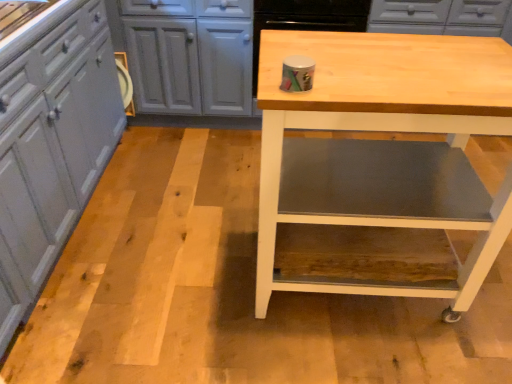
Question: Based on their positions, is matte gray cabinets at left located to the left or right of natural wood table at center?

Choices:
 (A) left
 (B) right

Answer: (A)

Question: In terms of width, does matte gray cabinets at left look wider or thinner when compared to natural wood table at center?

Choices:
 (A) thin
 (B) wide

Answer: (B)

Question: Considering the positions of matte gray cabinets at left and natural wood table at center in the image, is matte gray cabinets at left bigger or smaller than natural wood table at center?

Choices:
 (A) small
 (B) big

Answer: (B)

Question: From a real-world perspective, relative to matte gray cabinets at left, is natural wood table at center vertically above or below?

Choices:
 (A) below
 (B) above

Answer: (B)

Question: In terms of height, does natural wood table at center look taller or shorter compared to matte gray cabinets at left?

Choices:
 (A) short
 (B) tall

Answer: (A)

Question: Considering the positions of natural wood table at center and matte gray cabinets at left in the image, is natural wood table at center wider or thinner than matte gray cabinets at left?

Choices:
 (A) wide
 (B) thin

Answer: (B)

Question: Considering the relative positions of natural wood table at center and matte gray cabinets at left in the image provided, is natural wood table at center to the left or to the right of matte gray cabinets at left?

Choices:
 (A) right
 (B) left

Answer: (A)